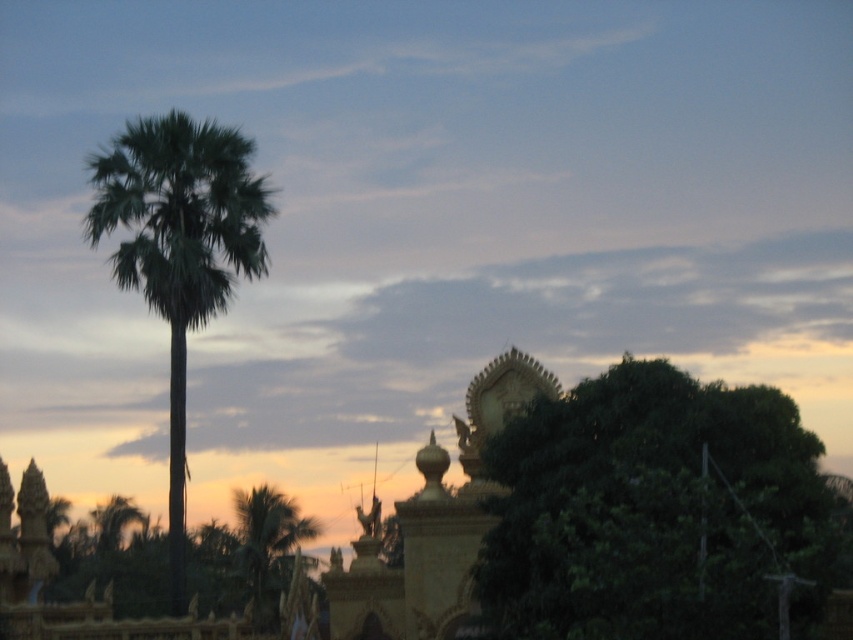
Which is behind, point (723, 512) or point (279, 561)?

The point (279, 561) is behind.

Does green leafy tree at lower right have a lesser height compared to green leafy palm tree at lower left?

No.

Between point (672, 385) and point (276, 500), which one is positioned behind?

Positioned behind is point (276, 500).

This screenshot has width=853, height=640. I want to click on green leafy tree at lower right, so click(x=656, y=513).

Is green leafy tree at lower right positioned at the back of green leafy palm at left?

No, it is in front of green leafy palm at left.

Between green leafy tree at lower right and green leafy palm at left, which one appears on the right side from the viewer's perspective?

Positioned to the right is green leafy tree at lower right.

Which is in front, point (728, 451) or point (234, 216)?

Point (728, 451) is in front.

At what (x,y) coordinates should I click in order to perform the action: click on green leafy tree at lower right. Please return your answer as a coordinate pair (x, y). The height and width of the screenshot is (640, 853). Looking at the image, I should click on (656, 513).

Is green leafy palm at left positioned in front of green leafy palm tree at lower left?

Yes, green leafy palm at left is in front of green leafy palm tree at lower left.

Locate an element on the screen. The width and height of the screenshot is (853, 640). green leafy palm at left is located at coordinates (178, 250).